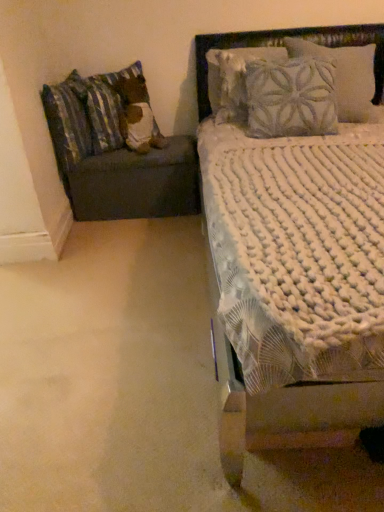
Question: Is dark gray fabric ottoman at left thinner than white textured bed at upper right?

Choices:
 (A) no
 (B) yes

Answer: (B)

Question: Is dark gray fabric ottoman at left taller than white textured bed at upper right?

Choices:
 (A) yes
 (B) no

Answer: (B)

Question: Considering the relative sizes of dark gray fabric ottoman at left and white textured bed at upper right in the image provided, is dark gray fabric ottoman at left smaller than white textured bed at upper right?

Choices:
 (A) yes
 (B) no

Answer: (A)

Question: From a real-world perspective, is dark gray fabric ottoman at left on top of white textured bed at upper right?

Choices:
 (A) no
 (B) yes

Answer: (A)

Question: From the image's perspective, is dark gray fabric ottoman at left below white textured bed at upper right?

Choices:
 (A) yes
 (B) no

Answer: (B)

Question: Considering the relative sizes of dark gray fabric ottoman at left and white textured bed at upper right in the image provided, is dark gray fabric ottoman at left shorter than white textured bed at upper right?

Choices:
 (A) no
 (B) yes

Answer: (B)

Question: Does dark gray fabric ottoman at left lie behind striped fabric pillow at left, the 1th pillow positioned from the left?

Choices:
 (A) yes
 (B) no

Answer: (A)

Question: Is dark gray fabric ottoman at left bigger than striped fabric pillow at left, the 1th pillow positioned from the left?

Choices:
 (A) yes
 (B) no

Answer: (A)

Question: Is dark gray fabric ottoman at left to the left of striped fabric pillow at left, the 1th pillow positioned from the left, from the viewer's perspective?

Choices:
 (A) yes
 (B) no

Answer: (B)

Question: Is dark gray fabric ottoman at left wider than striped fabric pillow at left, the 1th pillow positioned from the left?

Choices:
 (A) no
 (B) yes

Answer: (B)

Question: Does dark gray fabric ottoman at left appear on the right side of striped fabric pillow at left, placed as the 2th pillow when sorted from right to left?

Choices:
 (A) no
 (B) yes

Answer: (B)

Question: Is striped fabric pillow at left, the 1th pillow positioned from the left, completely or partially inside dark gray fabric ottoman at left?

Choices:
 (A) no
 (B) yes

Answer: (A)

Question: Is dark gray fabric ottoman at left not inside fluffy fabric headboard at upper right?

Choices:
 (A) yes
 (B) no

Answer: (A)